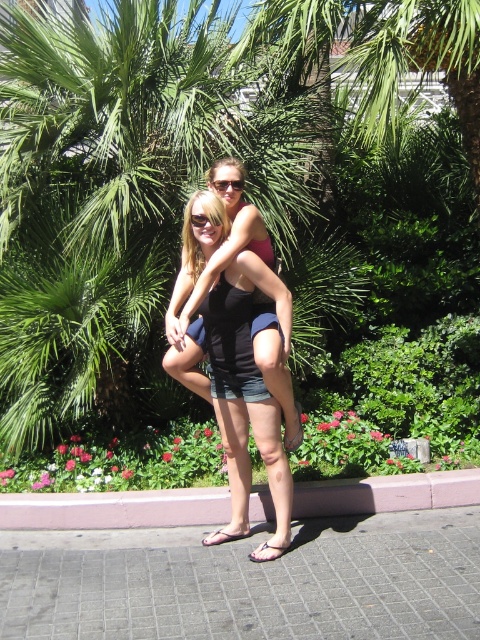
You are standing in the scene and want to throw a ball to the matte black shorts at center. Considering the distance, will the ball travel more than 3 meters?

The distance between the matte black shorts at center and the viewer is 3.98 meters, so yes, the ball will travel more than 3 meters to reach the matte black shorts at center.

You are standing in the scene and want to pick up the matte black sunglasses at center and the black rubber sandal at lower center. Which object should you reach for first to pick up the closest one?

The matte black sunglasses at center is closer to you than the black rubber sandal at lower center, so you should reach for the matte black sunglasses at center first.